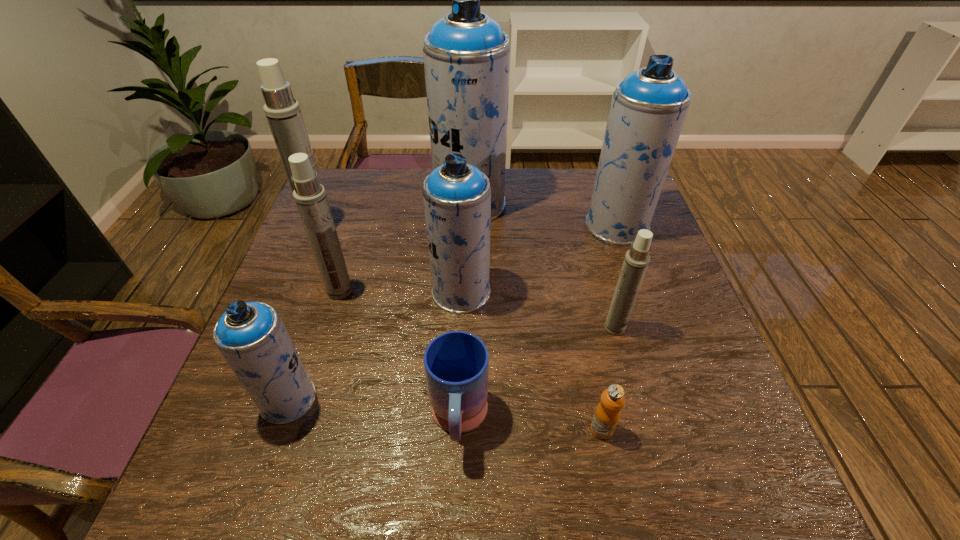
Find the location of a particular element. The image size is (960, 540). aerosol can that is the closest to the third farthest blue aerosol can is located at coordinates (466, 54).

Where is `aerosol can that is the fourth nearest to the seventh object from left to right`? Image resolution: width=960 pixels, height=540 pixels. aerosol can that is the fourth nearest to the seventh object from left to right is located at coordinates (251, 336).

Choose which blue aerosol can is the nearest neighbor to the third object from right to left. Please provide its 2D coordinates. Your answer should be formatted as a tuple, i.e. [(x, y)], where the tuple contains the x and y coordinates of a point satisfying the conditions above.

[(457, 196)]

Choose which blue aerosol can is the third nearest neighbor to the seventh object from left to right. Please provide its 2D coordinates. Your answer should be formatted as a tuple, i.e. [(x, y)], where the tuple contains the x and y coordinates of a point satisfying the conditions above.

[(251, 336)]

The width and height of the screenshot is (960, 540). I want to click on the third closest white aerosol can relative to the smallest blue aerosol can, so click(x=636, y=261).

Where is `white aerosol can that is the third closest to the tallest aerosol can`? white aerosol can that is the third closest to the tallest aerosol can is located at coordinates (636, 261).

You are a GUI agent. You are given a task and a screenshot of the screen. Output one action in this format:
    pyautogui.click(x=<x>, y=<y>)
    Task: Click on the vacant space that satisfies the following two spatial constraints: 1. on the front side of the second smallest blue aerosol can; 2. on the left side of the second white aerosol can from left to right
    
    Given the screenshot: What is the action you would take?
    pyautogui.click(x=340, y=292)

The width and height of the screenshot is (960, 540). In order to click on free point that satisfies the following two spatial constraints: 1. on the front side of the biggest white aerosol can; 2. on the right side of the rightmost white aerosol can in this screenshot , I will do [x=281, y=328].

Where is `free spot that satisfies the following two spatial constraints: 1. on the back side of the rightmost white aerosol can; 2. on the left side of the second biggest blue aerosol can`? This screenshot has width=960, height=540. free spot that satisfies the following two spatial constraints: 1. on the back side of the rightmost white aerosol can; 2. on the left side of the second biggest blue aerosol can is located at coordinates (587, 226).